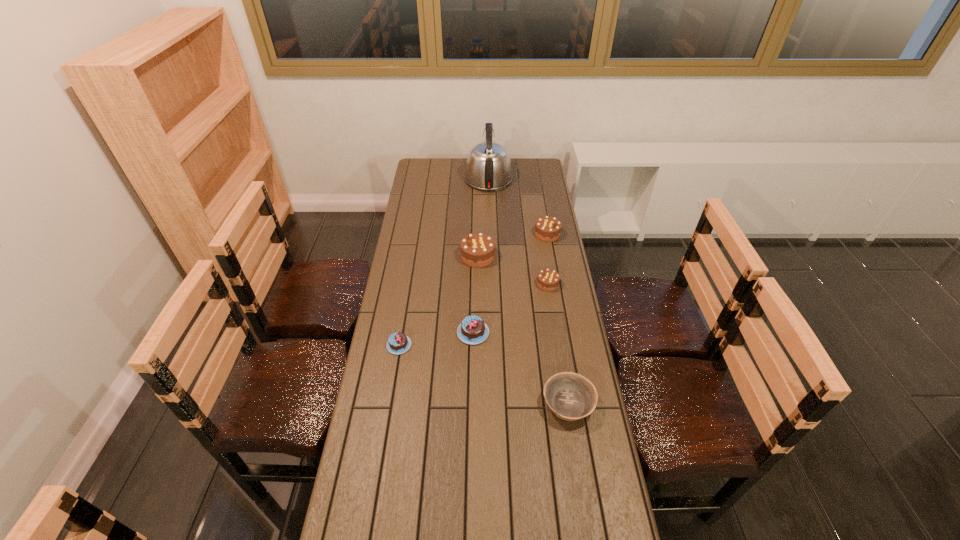
Find the location of a particular element. This screenshot has width=960, height=540. gray kettle is located at coordinates point(488,167).

Identify the location of the tallest object. Image resolution: width=960 pixels, height=540 pixels. (488, 167).

Find the location of a particular element. The image size is (960, 540). the third farthest object is located at coordinates (477, 250).

You are a GUI agent. You are given a task and a screenshot of the screen. Output one action in this format:
    pyautogui.click(x=<x>, y=<y>)
    Task: Click on the second farthest chocolate cake
    Image resolution: width=960 pixels, height=540 pixels.
    Given the screenshot: What is the action you would take?
    pyautogui.click(x=477, y=250)

Identify the location of the fourth shortest chocolate cake. This screenshot has height=540, width=960. (547, 228).

Identify the location of the farthest brown chocolate cake. (547, 228).

Identify the location of the third nearest chocolate cake. The width and height of the screenshot is (960, 540). (548, 280).

Locate an element on the screen. Image resolution: width=960 pixels, height=540 pixels. the smallest brown chocolate cake is located at coordinates (548, 280).

Identify the location of the bigger pink chocolate cake. (472, 330).

This screenshot has width=960, height=540. Identify the location of bowl. (570, 396).